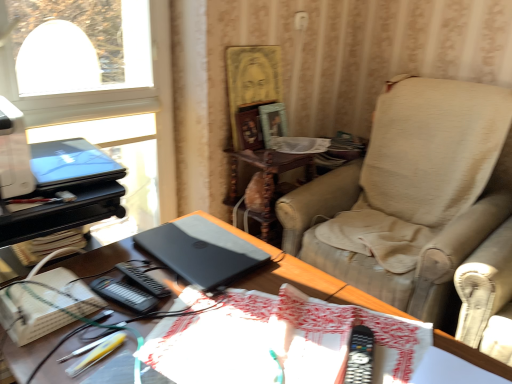
The height and width of the screenshot is (384, 512). Identify the location of vacant space behind white cardboard book at lower left. (104, 261).